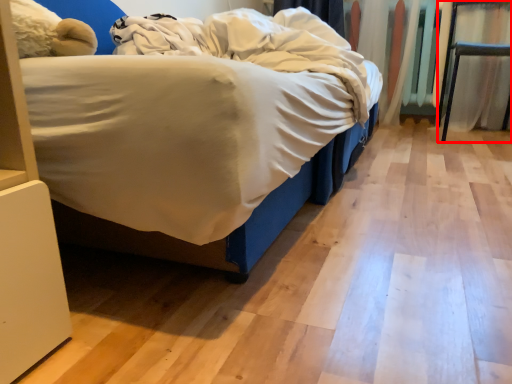
Question: From the image's perspective, what is the correct spatial positioning of furniture (annotated by the red box) in reference to blanket?

Choices:
 (A) below
 (B) above

Answer: (B)